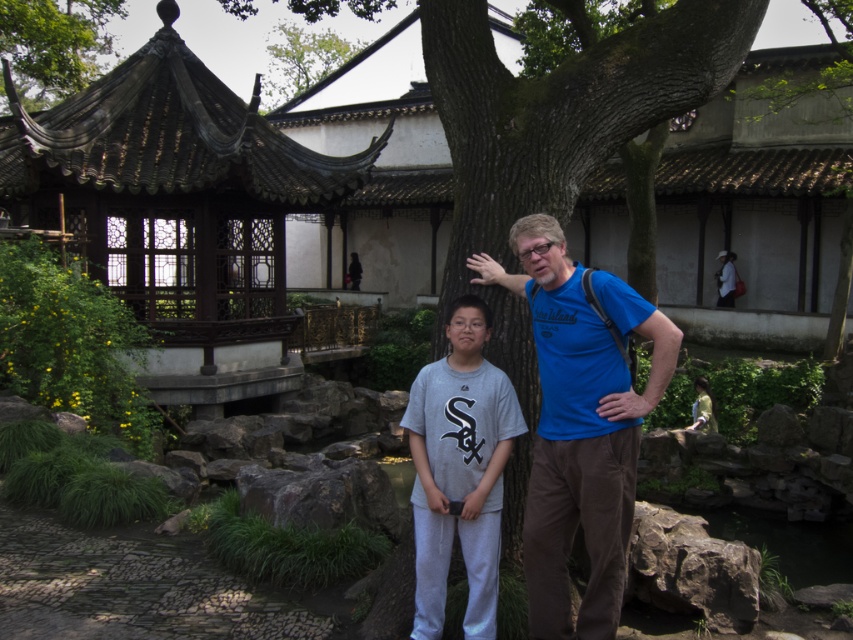
You are a tailor measuring two people in the garden scene. You need to determine which clothing item, the blue cotton shirt at center or the gray sweatpants at center, requires more fabric for a similar design. Based on their widths, which one would need more material?

The blue cotton shirt at center has a greater width than the gray sweatpants at center, so it would require more fabric for a similar design.

You are a photographer standing at the camera position in the scene. You want to take a photo of the smooth brown tree trunk at upper left. However, there is a 20.5 meter wide fence blocking your path. Can you fit the tree trunk into your photo without moving the camera?

The distance between the smooth brown tree trunk at upper left and the camera is 20.70 meters. Since the fence is only 20.5 meters wide, the tree trunk is just barely beyond the fence. Therefore, you can capture it in your photo without moving the camera.

You are a landscape architect designing a walking path between the smooth brown tree trunk at upper left and the green leafy tree at upper center. The path must be 50 feet long. Can you fit the path between them?

The distance between the smooth brown tree trunk at upper left and the green leafy tree at upper center is 54.86 feet. Since the required path length is 50 feet, the path can be accommodated between them as the available space is longer than needed.